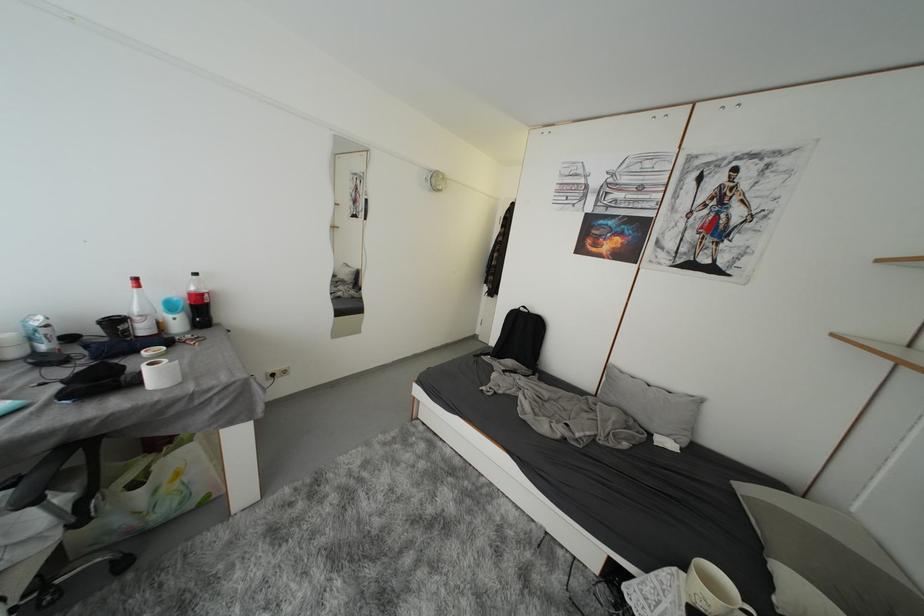
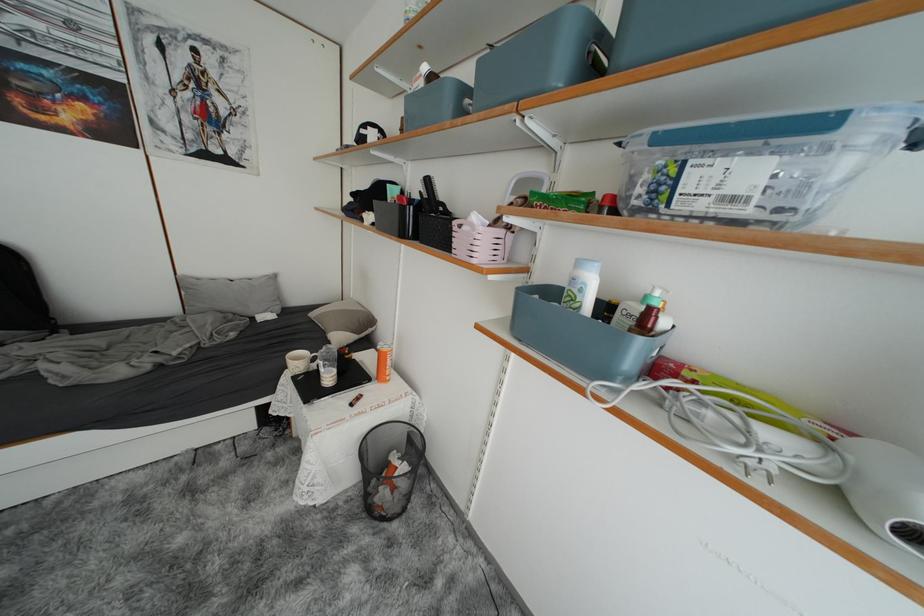
Where in the second image is the point corresponding to (658,386) from the first image?

(238, 281)